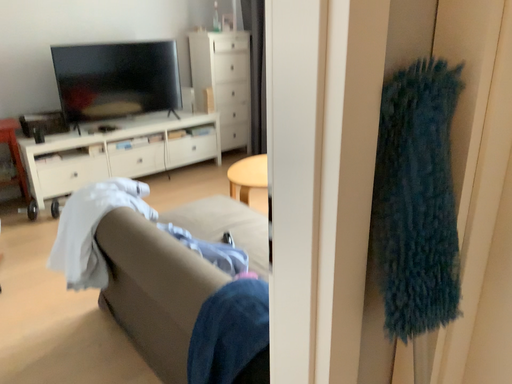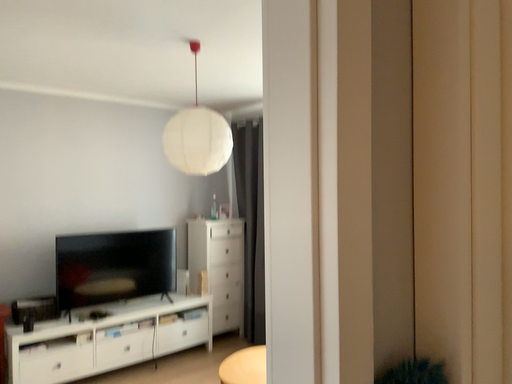
Question: How did the camera likely rotate when shooting the video?

Choices:
 (A) rotated downward
 (B) rotated upward

Answer: (B)